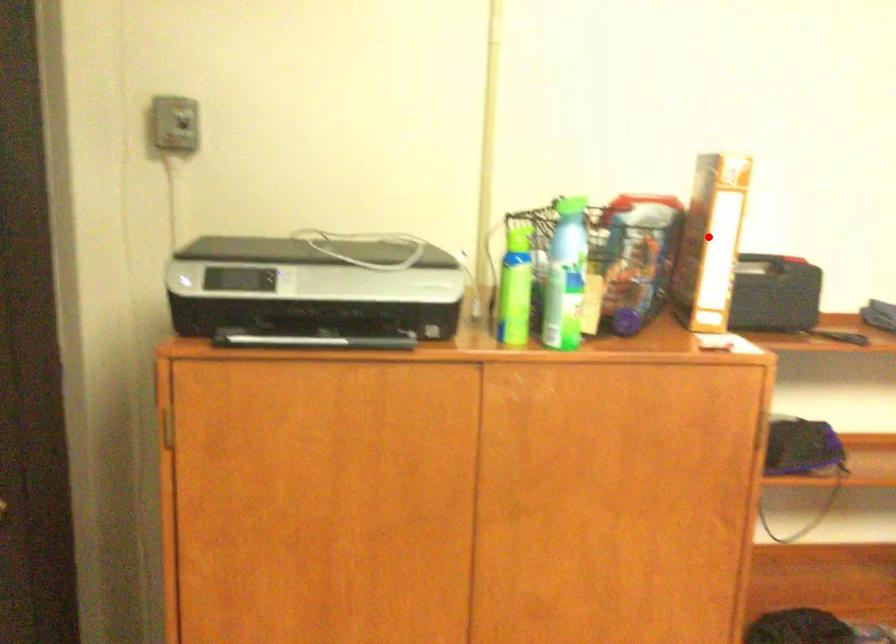
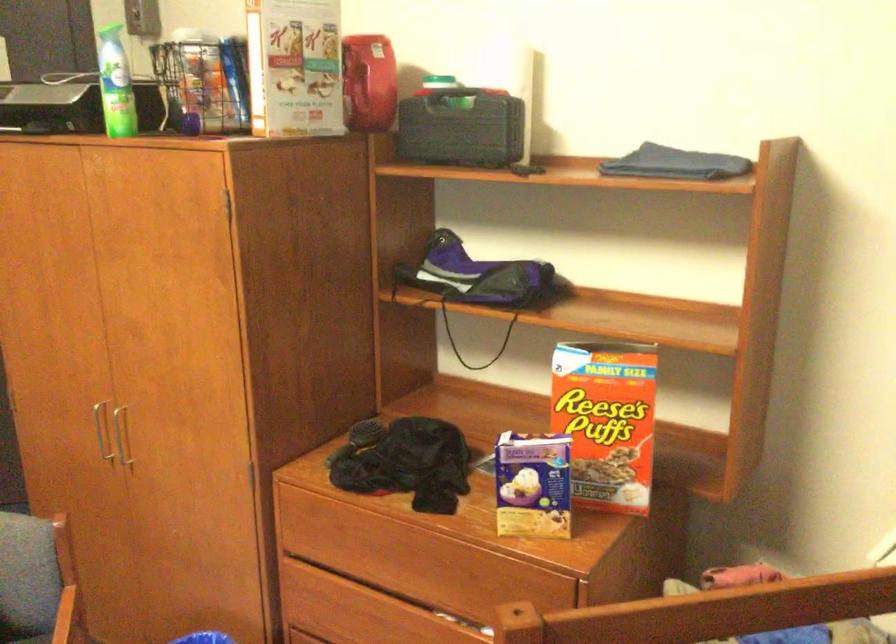
In the second image, find the point that corresponds to the highlighted location in the first image.

(368, 82)